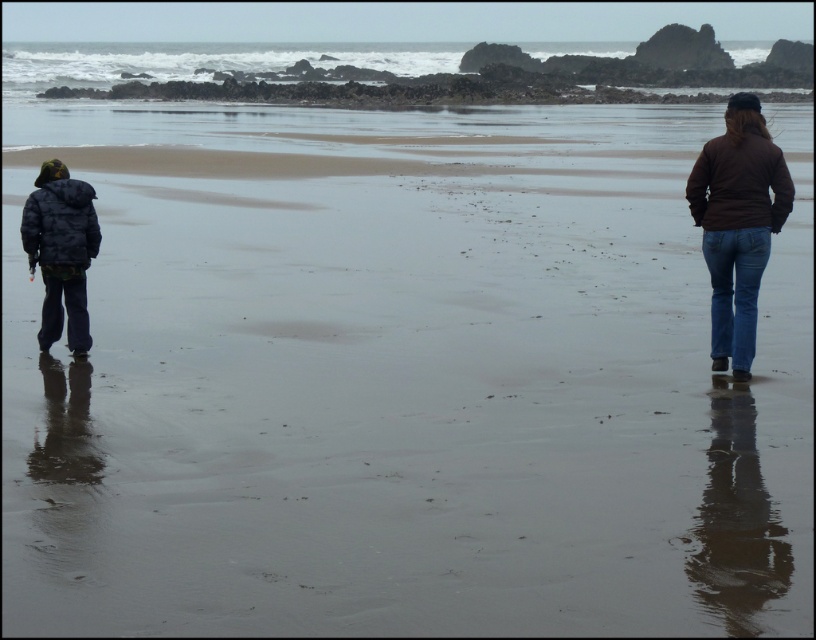
You are a photographer trying to capture the reflections on the beach. You notice the gray wet sand at upper center and the dark gray puffy jacket at left. Which object would likely provide a better reflection, and why?

The gray wet sand at upper center would likely provide a better reflection because it is larger than the dark gray puffy jacket at left, allowing for a more expansive and detailed reflection surface.

You are a photographer trying to capture both the brown denim jeans at right and the camouflage jacket at left in a single shot. Based on their positions, which one is closer to the camera?

The brown denim jeans at right is positioned over camouflage jacket at left, so the brown denim jeans at right is closer to the camera.